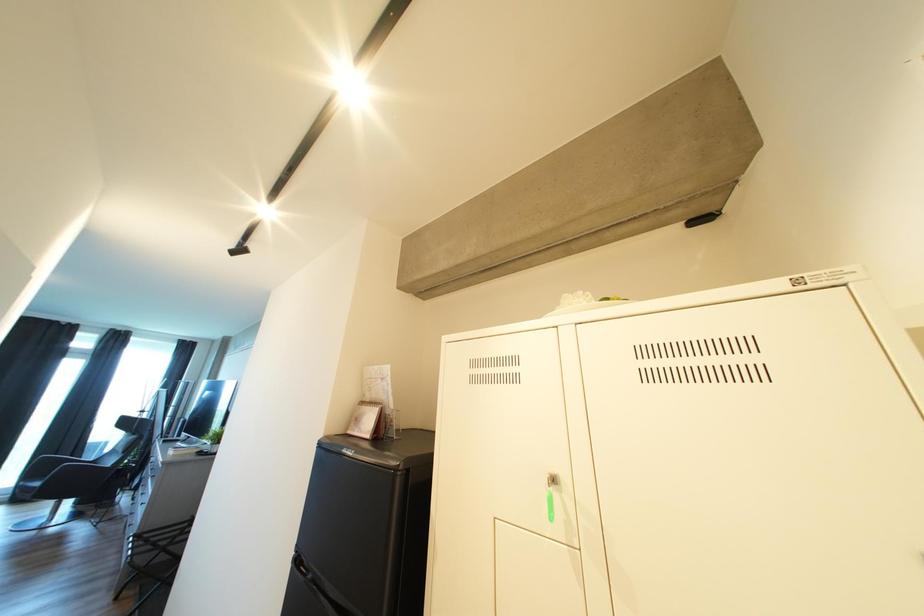
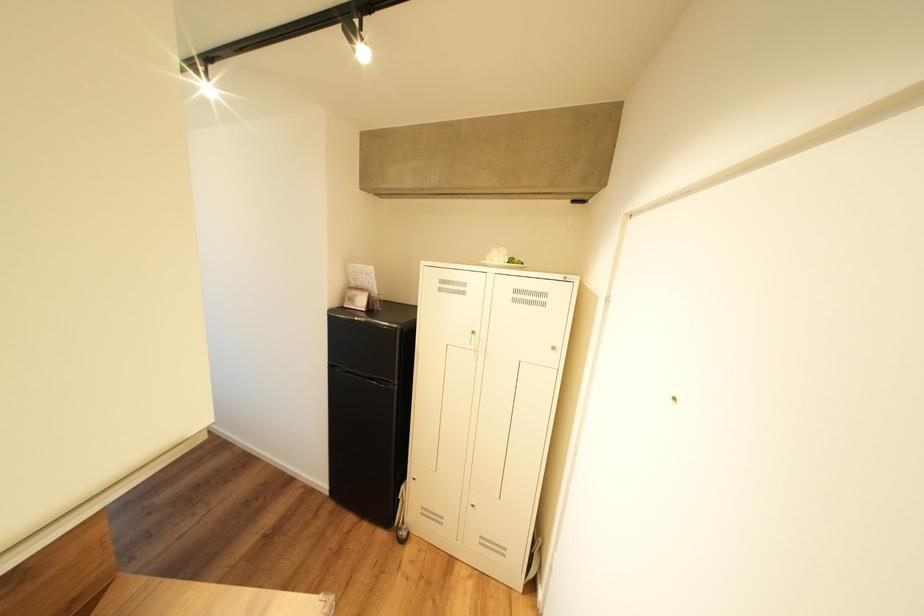
The first image is from the beginning of the video and the second image is from the end. How did the camera likely rotate when shooting the video?

The rotation direction of the camera is right-down.